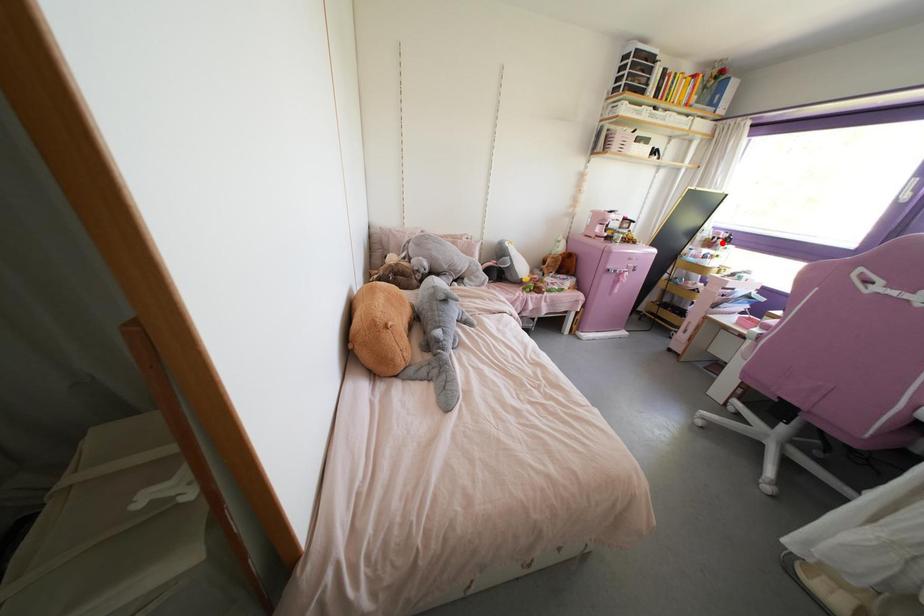
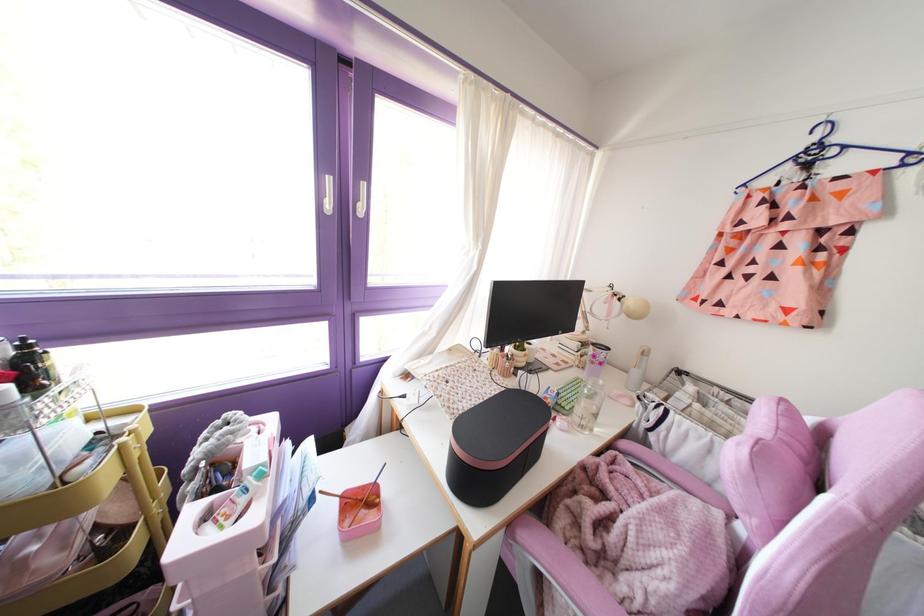
The point at the highlighted location is marked in the first image. Where is the corresponding point in the second image?

(32, 389)